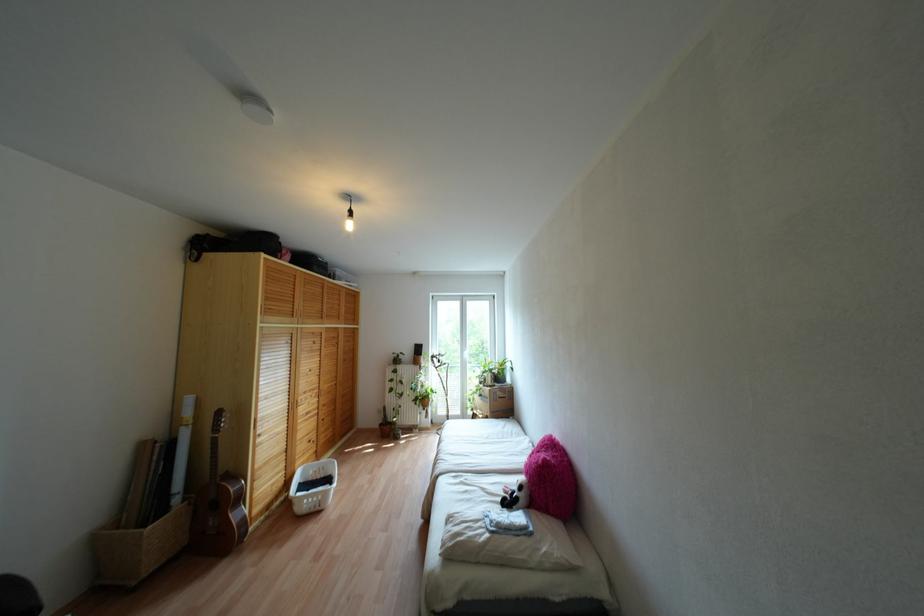
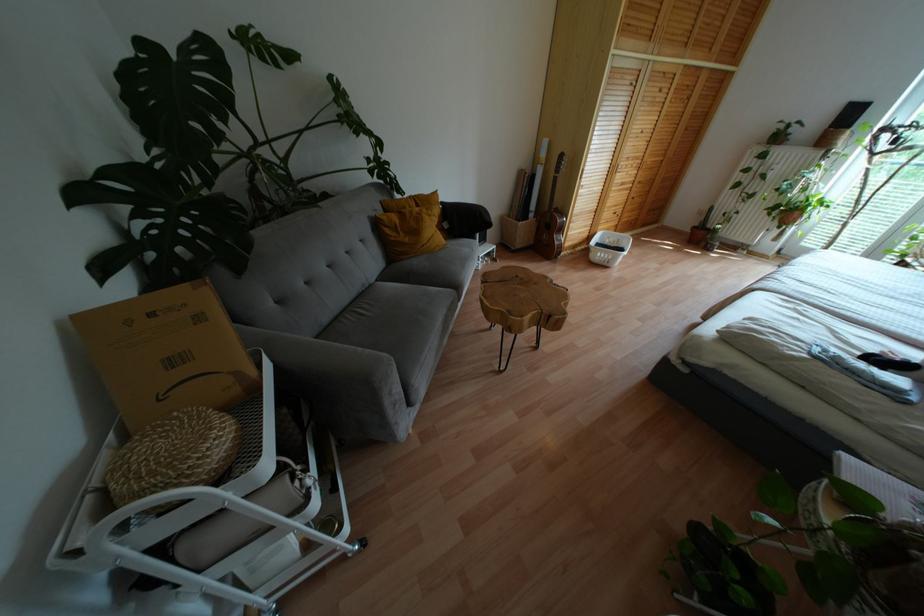
Find the pixel in the second image that matches point 238,498 in the first image.

(560, 229)